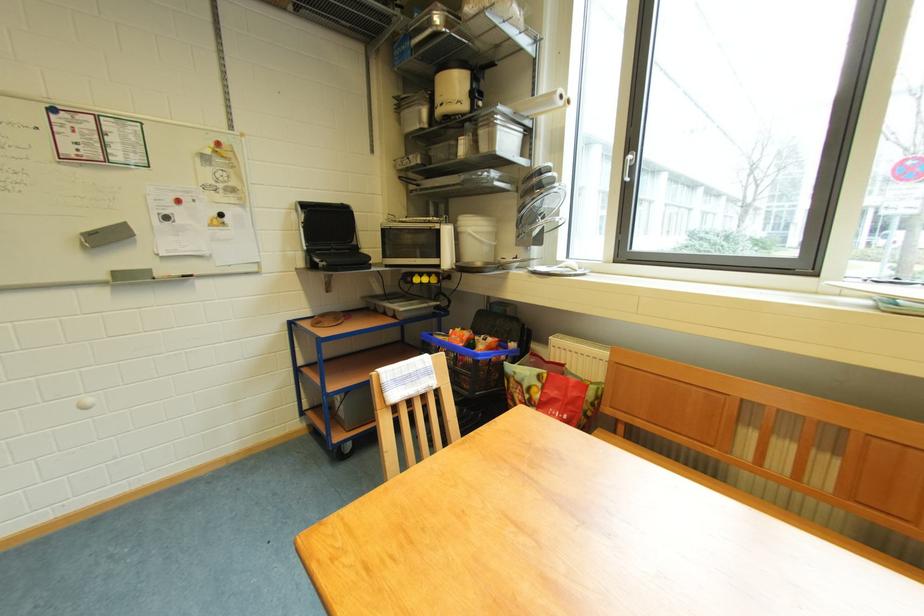
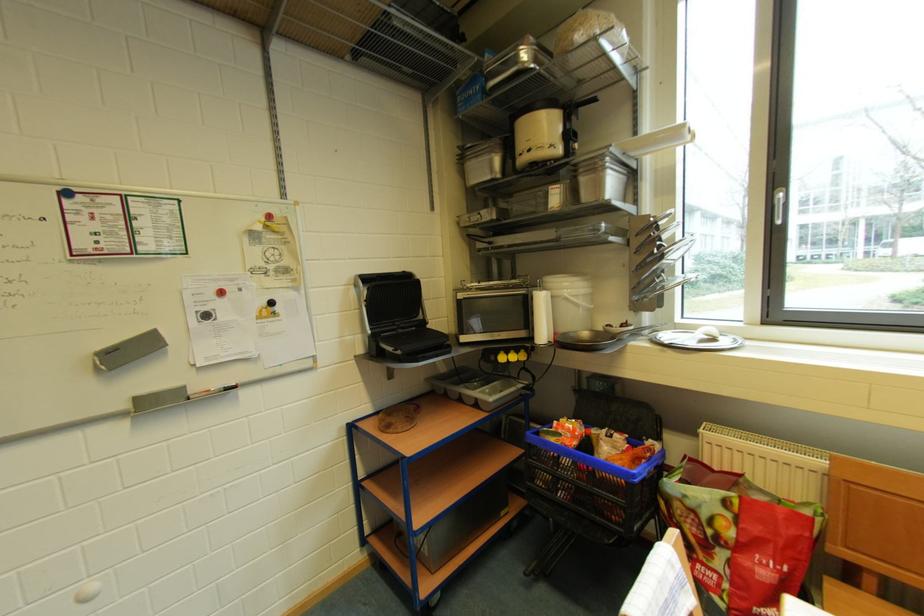
Where in the second image is the point corresponding to pixel 481 235 from the first image?

(578, 299)